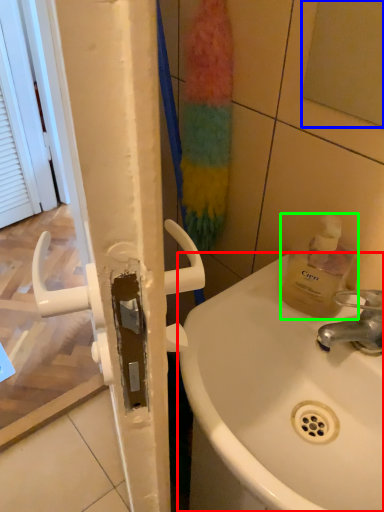
Question: Which object is positioned farthest from sink (highlighted by a red box)? Select from mirror (highlighted by a blue box) and bottle (highlighted by a green box).

Choices:
 (A) mirror
 (B) bottle

Answer: (A)